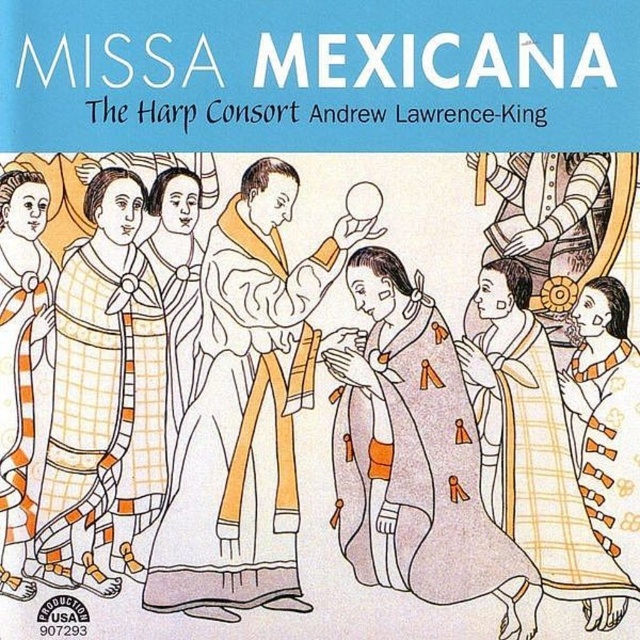
Image resolution: width=640 pixels, height=640 pixels. What do you see at coordinates (243, 412) in the screenshot?
I see `white clothed figure at center` at bounding box center [243, 412].

Measure the distance between point (205,588) and camera.

5.92 meters

From the picture: Who is more distant from viewer, (285,360) or (432,324)?

The point (285,360) is more distant.

Locate an element on the screen. Image resolution: width=640 pixels, height=640 pixels. white clothed figure at center is located at coordinates (243, 412).

Who is shorter, orange plaid robe at center or orange plaid dress at left?

Standing shorter between the two is orange plaid robe at center.

Does orange plaid robe at center lie behind orange plaid dress at left?

No, orange plaid robe at center is closer to the viewer.

You are a GUI agent. You are given a task and a screenshot of the screen. Output one action in this format:
    pyautogui.click(x=<x>, y=<y>)
    Task: Click on the orange plaid robe at center
    
    Given the screenshot: What is the action you would take?
    pyautogui.click(x=413, y=456)

Looking at this image, is white clothed figure at center bigger than orange striped robe at left?

Indeed, white clothed figure at center has a larger size compared to orange striped robe at left.

What do you see at coordinates (243, 412) in the screenshot? The height and width of the screenshot is (640, 640). I see `white clothed figure at center` at bounding box center [243, 412].

Find the location of a particular element. This screenshot has height=640, width=640. white clothed figure at center is located at coordinates (243, 412).